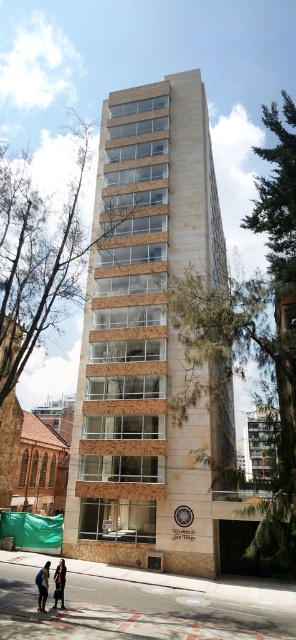
Can you confirm if blue denim jeans at lower left is wider than dark brown leather jacket at lower left?

Correct, the width of blue denim jeans at lower left exceeds that of dark brown leather jacket at lower left.

Is blue denim jeans at lower left positioned in front of dark brown leather jacket at lower left?

Yes, blue denim jeans at lower left is in front of dark brown leather jacket at lower left.

Which is behind, point (41, 596) or point (57, 589)?

The point (57, 589) is behind.

Where is `blue denim jeans at lower left`? The width and height of the screenshot is (296, 640). blue denim jeans at lower left is located at coordinates [x=42, y=584].

Does beige stone building at center have a greater height compared to dark brown leather jacket at lower left?

Correct, beige stone building at center is much taller as dark brown leather jacket at lower left.

Can you confirm if beige stone building at center is positioned above dark brown leather jacket at lower left?

Yes.

Between point (116, 97) and point (63, 600), which one is positioned behind?

Point (116, 97)

Image resolution: width=296 pixels, height=640 pixels. I want to click on beige stone building at center, so click(147, 340).

Is beige stone building at center thinner than blue denim jeans at lower left?

No, beige stone building at center is not thinner than blue denim jeans at lower left.

What do you see at coordinates (147, 340) in the screenshot? I see `beige stone building at center` at bounding box center [147, 340].

Identify the location of beige stone building at center. (147, 340).